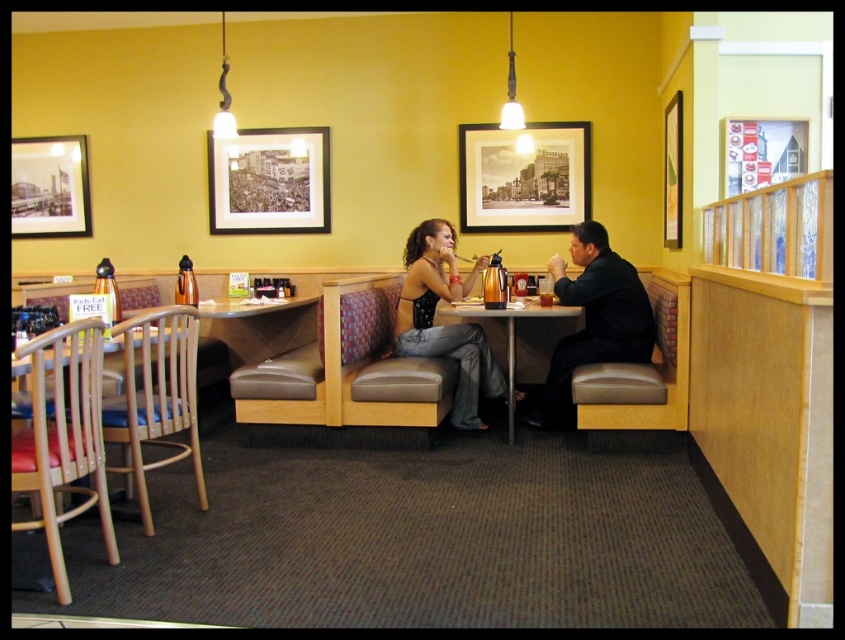
You are sitting at the table in the restaurant and want to reach for an item located at point (647, 333). Is this point closer to you or further away compared to point (530, 305)?

The point (647, 333) is in front of point (530, 305), so it is closer to you.

You are a delivery person who just entered the restaurant and need to place a new black leather jacket at center. The restaurant manager says the black matte picture frame at upper center must remain exactly 8.11 feet away from the jacket. Where should you place the new jacket?

Place the new black leather jacket at center so it stays exactly 8.11 feet away from the black matte picture frame at upper center as required.

You are a restaurant employee who needs to place a new menu between the black matte picture frame at upper center and the black leather jacket at center. Where should you place it?

The black matte picture frame at upper center is positioned on the left side of black leather jacket at center, so you should place the new menu to the right of the black matte picture frame at upper center or to the left of the black leather jacket at center to ensure it is between them.